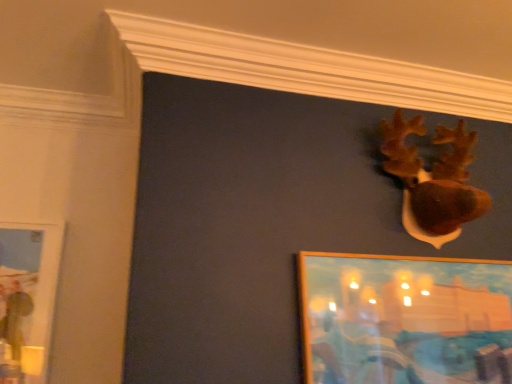
This screenshot has height=384, width=512. Describe the element at coordinates (405, 319) in the screenshot. I see `wooden framed painting at lower right` at that location.

Measure the distance between wooden framed painting at lower right and camera.

The depth of wooden framed painting at lower right is 3.87 feet.

Identify the location of wooden framed painting at lower right. The height and width of the screenshot is (384, 512). (405, 319).

Where is `wooden framed painting at lower right`? Image resolution: width=512 pixels, height=384 pixels. wooden framed painting at lower right is located at coordinates (405, 319).